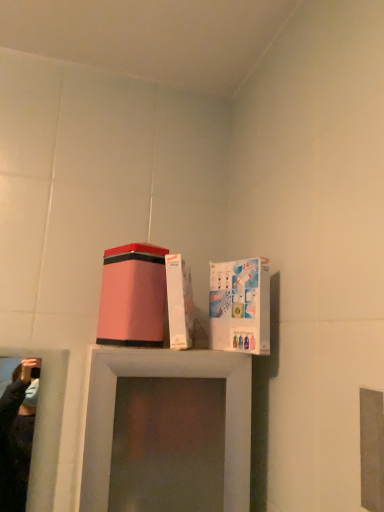
Question: Is white glossy cardboard box at upper right to the left or to the right of matte pink box at center in the image?

Choices:
 (A) left
 (B) right

Answer: (B)

Question: From the image's perspective, is white glossy cardboard box at upper right located above or below matte pink box at center?

Choices:
 (A) above
 (B) below

Answer: (B)

Question: Relative to matte pink box at center, is white glossy cardboard box at upper right in front or behind?

Choices:
 (A) front
 (B) behind

Answer: (A)

Question: From the image's perspective, relative to white glossy cardboard box at upper right, is matte pink box at center above or below?

Choices:
 (A) above
 (B) below

Answer: (A)

Question: Which is correct: matte pink box at center is inside white glossy cardboard box at upper right, or outside of it?

Choices:
 (A) outside
 (B) inside

Answer: (A)

Question: From a real-world perspective, is matte pink box at center physically located above or below white glossy cardboard box at upper right?

Choices:
 (A) below
 (B) above

Answer: (B)

Question: Considering the positions of matte pink box at center and white glossy cardboard box at upper right in the image, is matte pink box at center wider or thinner than white glossy cardboard box at upper right?

Choices:
 (A) wide
 (B) thin

Answer: (A)